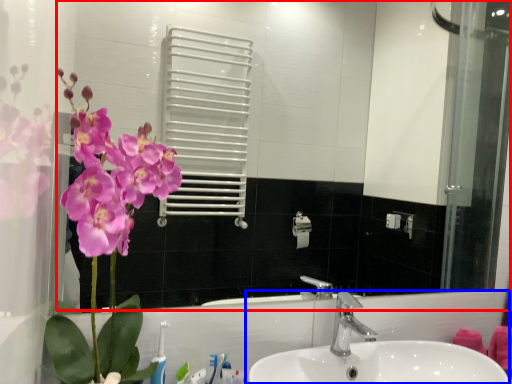
Question: Which object is closer to the camera taking this photo, mirror (highlighted by a red box) or sink (highlighted by a blue box)?

Choices:
 (A) mirror
 (B) sink

Answer: (B)